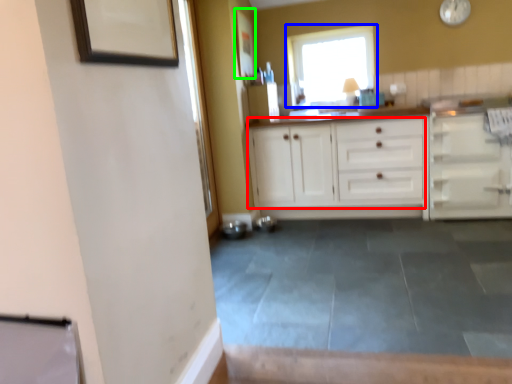
Question: Considering the real-world distances, which object is closest to cabinetry (highlighted by a red box)? window (highlighted by a blue box) or picture frame (highlighted by a green box).

Choices:
 (A) window
 (B) picture frame

Answer: (A)